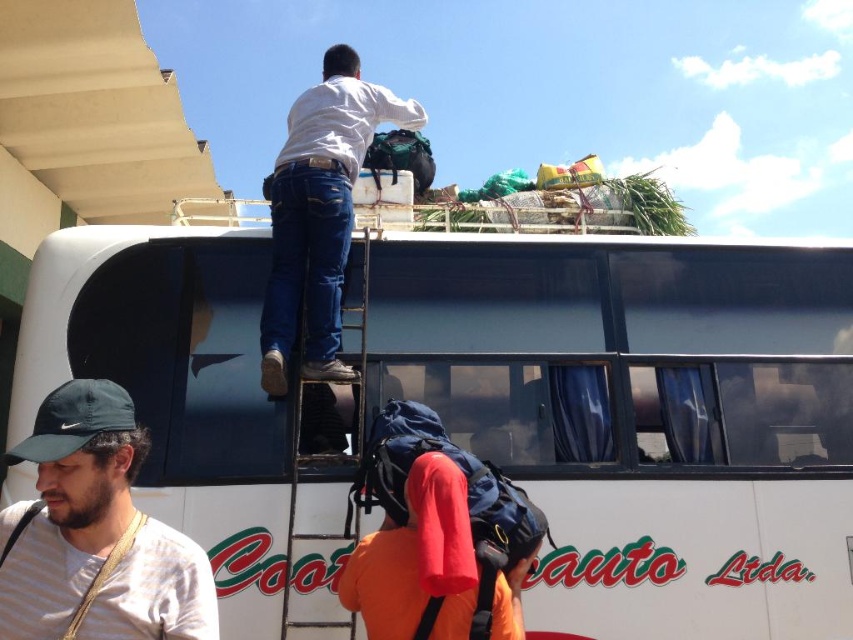
Between striped cotton shirt at lower left and metallic silver ladder at upper center, which one appears on the right side from the viewer's perspective?

metallic silver ladder at upper center is more to the right.

Is point (167, 582) more distant than point (300, 384)?

No.

Find the location of a particular element. striped cotton shirt at lower left is located at coordinates (96, 532).

Is point (708, 252) behind point (183, 588)?

Yes.

Where is `white matte bus at upper center`? This screenshot has width=853, height=640. white matte bus at upper center is located at coordinates click(639, 416).

Does point (538, 406) lie in front of point (364, 392)?

No.

Can you confirm if white matte bus at upper center is bigger than metallic silver ladder at upper center?

Correct, white matte bus at upper center is larger in size than metallic silver ladder at upper center.

This screenshot has height=640, width=853. What do you see at coordinates (639, 416) in the screenshot?
I see `white matte bus at upper center` at bounding box center [639, 416].

The height and width of the screenshot is (640, 853). Find the location of `white matte bus at upper center`. white matte bus at upper center is located at coordinates (639, 416).